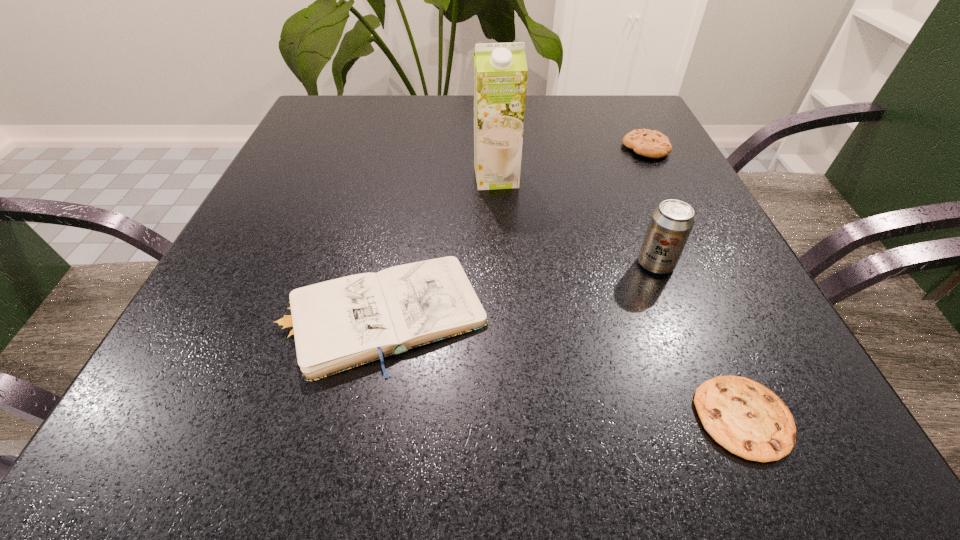
I want to click on blank space at the near edge, so click(544, 416).

In the image, there is a desktop. Where is `vacant region at the left edge`? The height and width of the screenshot is (540, 960). vacant region at the left edge is located at coordinates (320, 192).

Locate an element on the screen. This screenshot has height=540, width=960. free space at the right edge of the desktop is located at coordinates (667, 174).

Where is `vacant area at the far left corner of the desktop`? Image resolution: width=960 pixels, height=540 pixels. vacant area at the far left corner of the desktop is located at coordinates (314, 129).

Where is `free space at the near left corner`? This screenshot has height=540, width=960. free space at the near left corner is located at coordinates (246, 412).

I want to click on vacant space at the far right corner, so click(580, 101).

The width and height of the screenshot is (960, 540). In the image, there is a desktop. What are the coordinates of `vacant space at the near right corner` in the screenshot? It's located at (835, 453).

Where is `free space between the soya milk and the shortest object`? The image size is (960, 540). free space between the soya milk and the shortest object is located at coordinates (620, 298).

Locate an element on the screen. vacant region between the shortest object and the tallest object is located at coordinates (620, 298).

Where is `blank region between the second tallest object and the taller cookie`? This screenshot has width=960, height=540. blank region between the second tallest object and the taller cookie is located at coordinates (651, 206).